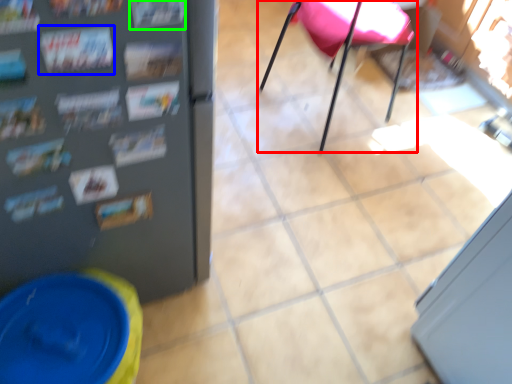
Question: Considering the real-world distances, which object is farthest from chair (highlighted by a red box)? magazine (highlighted by a blue box) or magazine (highlighted by a green box)?

Choices:
 (A) magazine
 (B) magazine

Answer: (A)